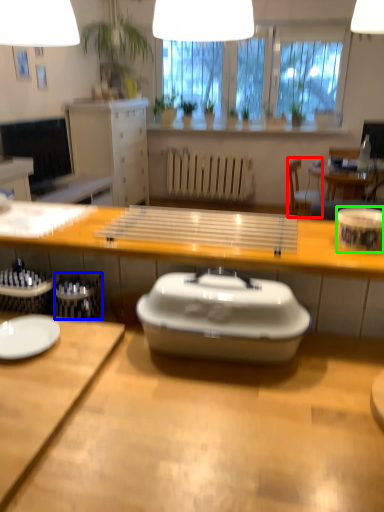
Question: Estimate the real-world distances between objects in this image. Which object is farther from chair (highlighted by a red box), trash bin/can (highlighted by a blue box) or tableware (highlighted by a green box)?

Choices:
 (A) trash bin/can
 (B) tableware

Answer: (A)